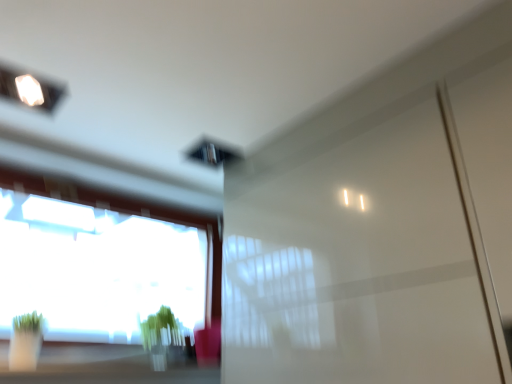
Question: Considering the positions of transparent glass window at lower left and glossy white screen door at center in the image, is transparent glass window at lower left taller or shorter than glossy white screen door at center?

Choices:
 (A) tall
 (B) short

Answer: (B)

Question: Looking at the image, does transparent glass window at lower left seem bigger or smaller compared to glossy white screen door at center?

Choices:
 (A) big
 (B) small

Answer: (B)

Question: Which object is positioned closest to the transparent glass window at lower left?

Choices:
 (A) glossy white screen door at center
 (B) green matte plant at lower center

Answer: (B)

Question: Which object is the closest to the glossy white screen door at center?

Choices:
 (A) transparent glass window at lower left
 (B) green matte plant at lower center

Answer: (B)